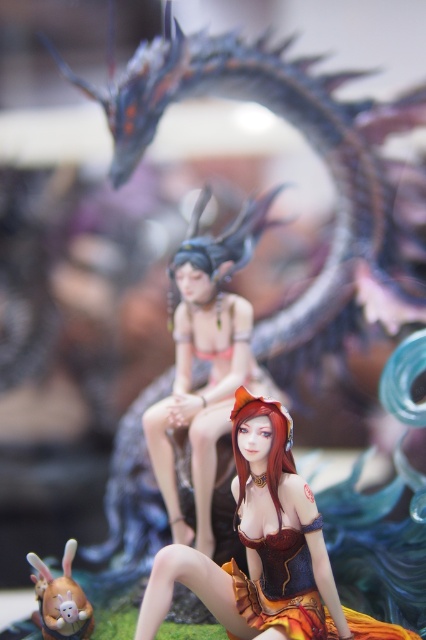
Looking at this image, is shiny orange fabric dress at center wider than matte brown plush rabbit at lower left?

Yes, shiny orange fabric dress at center is wider than matte brown plush rabbit at lower left.

How distant is shiny orange fabric dress at center from matte brown plush rabbit at lower left?

shiny orange fabric dress at center is 5.54 inches away from matte brown plush rabbit at lower left.

The width and height of the screenshot is (426, 640). In order to click on shiny orange fabric dress at center in this screenshot , I will do `click(262, 548)`.

Locate an element on the screen. The width and height of the screenshot is (426, 640). shiny orange fabric dress at center is located at coordinates (262, 548).

Is shiny orange fabric dress at center thinner than satin gold dress at center?

In fact, shiny orange fabric dress at center might be wider than satin gold dress at center.

Who is more distant from viewer, (x=301, y=554) or (x=233, y=349)?

The point (x=233, y=349) is behind.

Find the location of `shiny orange fabric dress at center`. shiny orange fabric dress at center is located at coordinates (262, 548).

Which is below, satin gold dress at center or matte brown plush rabbit at lower left?

Positioned lower is matte brown plush rabbit at lower left.

Does satin gold dress at center come behind matte brown plush rabbit at lower left?

Yes, it is behind matte brown plush rabbit at lower left.

Which is behind, point (261, 387) or point (34, 586)?

Point (261, 387)

Locate an element on the screen. Image resolution: width=426 pixels, height=640 pixels. satin gold dress at center is located at coordinates (207, 360).